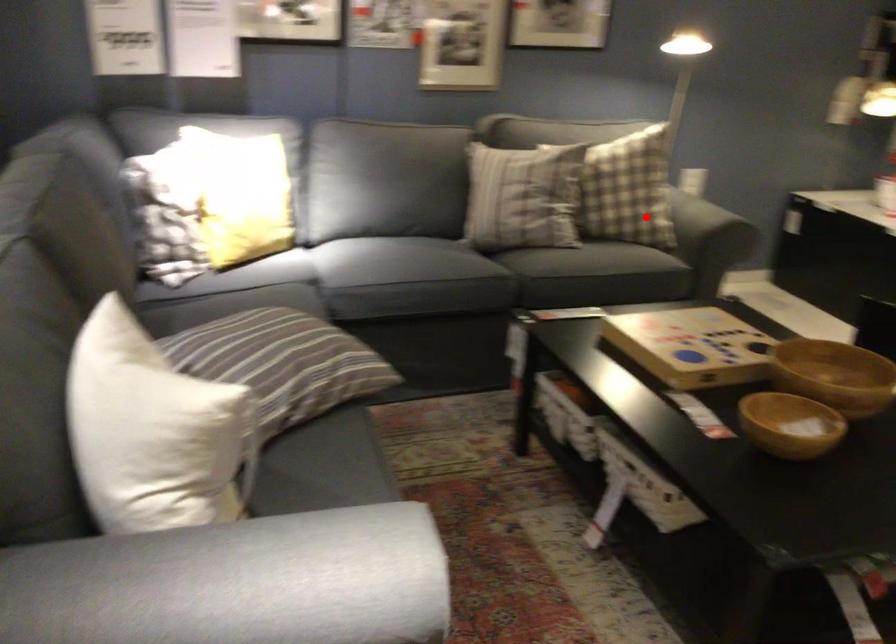
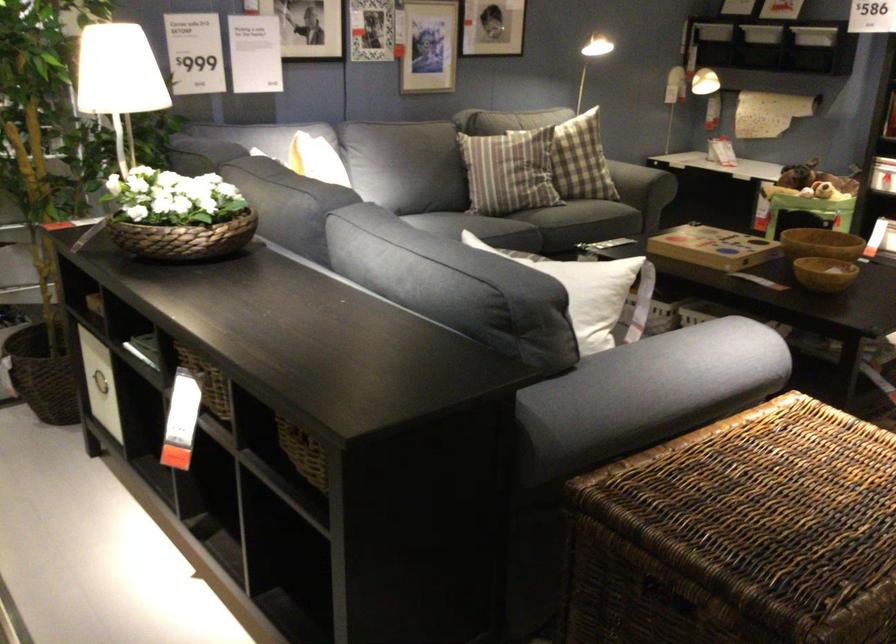
Question: I am providing you with two images of the same scene from different viewpoints. Image1 has a red point marked. In image2, the corresponding 3D location appears at what relative position? Reply with the corresponding letter.

Choices:
 (A) Closer
 (B) Farther

Answer: (B)